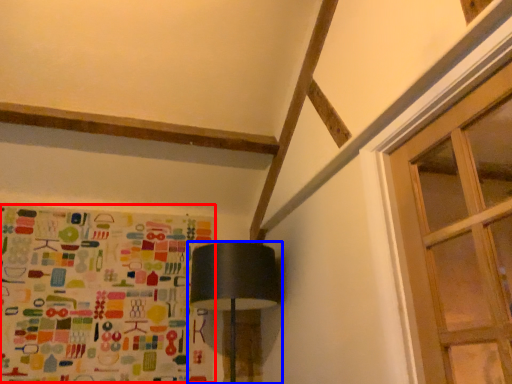
Question: Which of the following is the farthest to the observer, print (highlighted by a red box) or lamp (highlighted by a blue box)?

Choices:
 (A) print
 (B) lamp

Answer: (A)